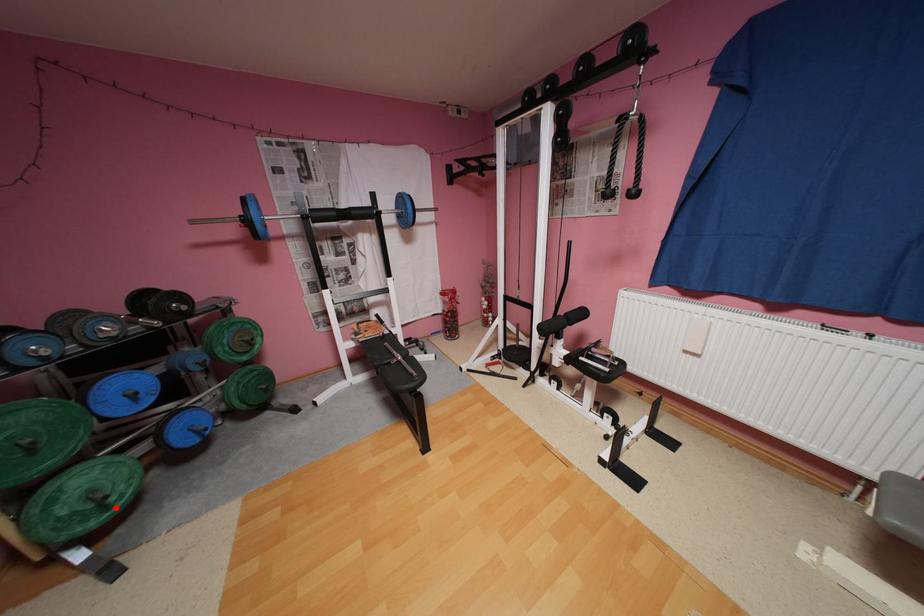
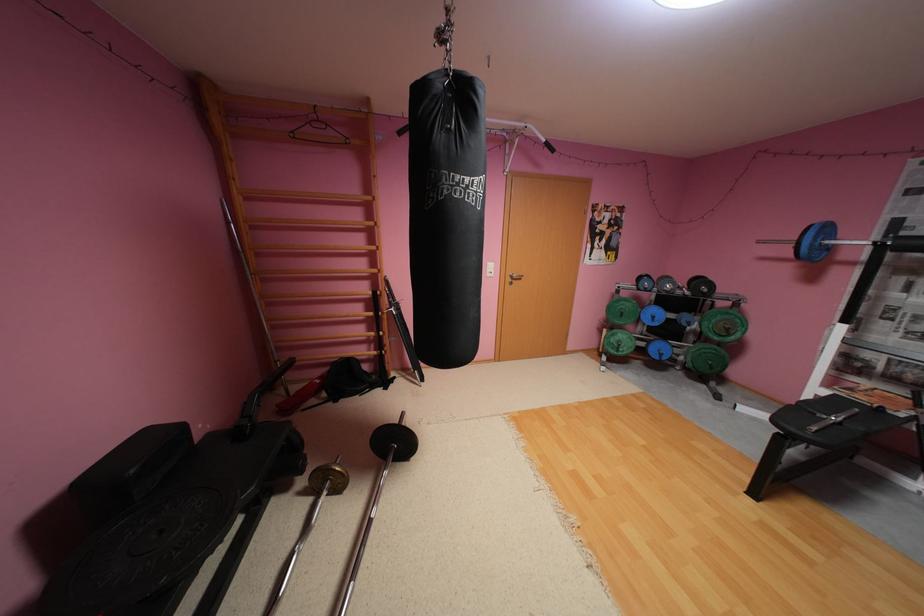
Question: I am providing you with two images of the same scene from different viewpoints. Given a red point in image1, look at the same physical point in image2. Is it:

Choices:
 (A) Closer to the viewpoint
 (B) Farther from the viewpoint

Answer: (B)